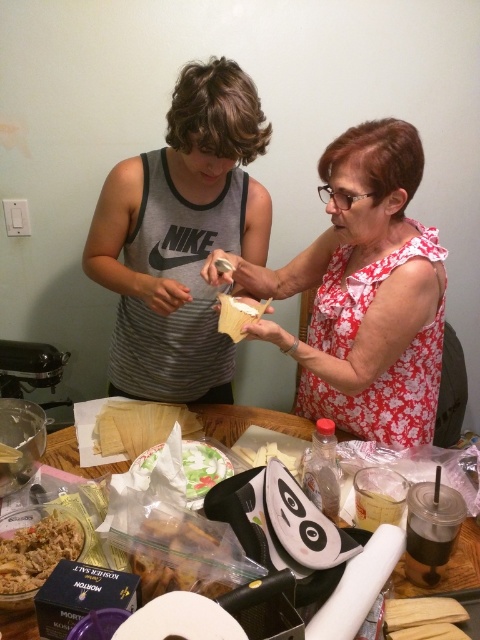
Question: Which of these objects is positioned closest to the floral fabric blouse at center?

Choices:
 (A) wooden table at center
 (B) white paper towel at center

Answer: (A)

Question: Is gray striped tank top at center thinner than white paper towel at center?

Choices:
 (A) yes
 (B) no

Answer: (B)

Question: Does floral fabric blouse at center appear under brown crispy snack at center?

Choices:
 (A) no
 (B) yes

Answer: (A)

Question: Which of these objects is positioned farthest from the brown crumbly mix at lower left?

Choices:
 (A) white paper towel at center
 (B) wooden table at center
 (C) floral fabric blouse at center
 (D) gray striped tank top at center

Answer: (C)

Question: Is wooden table at center further to camera compared to brown crispy snack at center?

Choices:
 (A) yes
 (B) no

Answer: (A)

Question: Which point is farther to the camera?

Choices:
 (A) white paper towel at center
 (B) brown crumbly mix at lower left
 (C) gray striped tank top at center
 (D) brown crispy snack at center

Answer: (C)